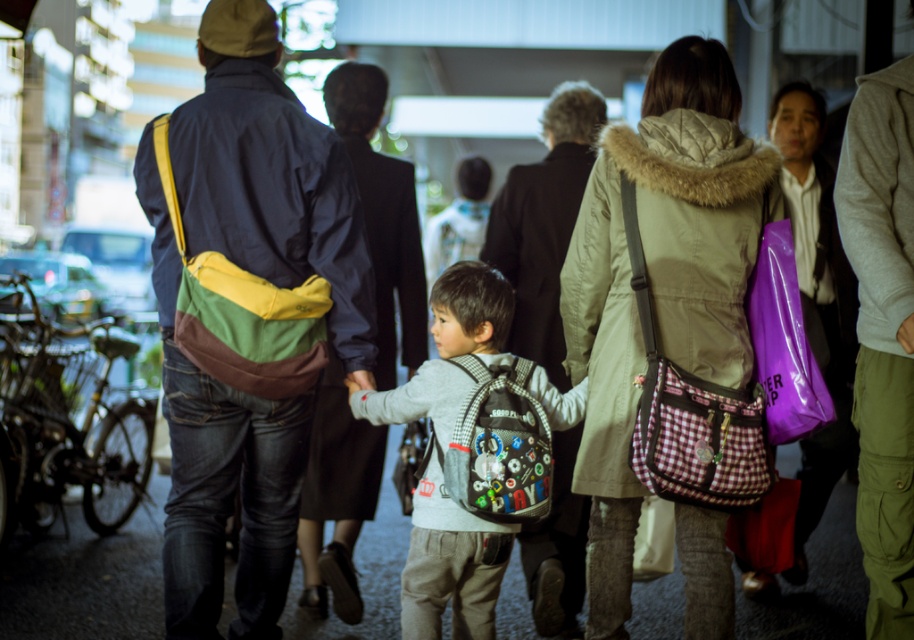
Based on the scene description, where exactly is the matte black jacket at center located in terms of coordinates?

The matte black jacket at center is located at point coordinates of (544, 224).

You are standing at point (798, 131) and want to walk to point (214, 125). Is the destination point in front of you or behind you?

The destination point (214, 125) is in front of your current position at point (798, 131) according to the spatial description provided.

You are standing at the origin of a coordinate system placed at the bottom left corner of the image. The coordinates of the point are given as point (544, 224). Which object is located at this coordinate?

The point (544, 224) corresponds to the matte black jacket at center.